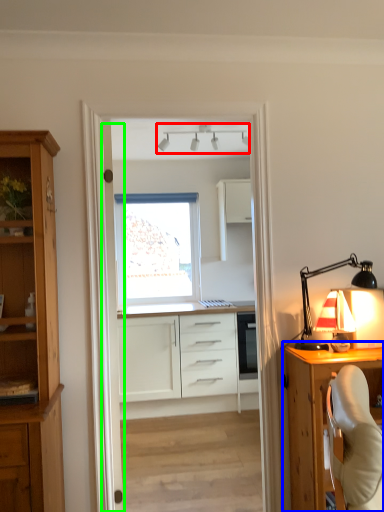
Question: Which object is positioned farthest from lamp (highlighted by a red box)? Select from cabinetry (highlighted by a blue box) and door (highlighted by a green box).

Choices:
 (A) cabinetry
 (B) door

Answer: (A)